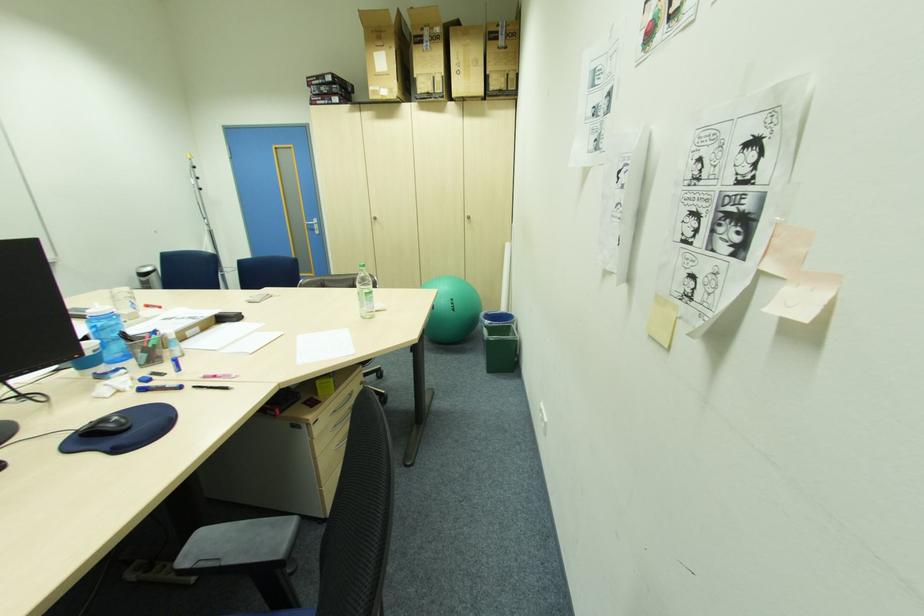
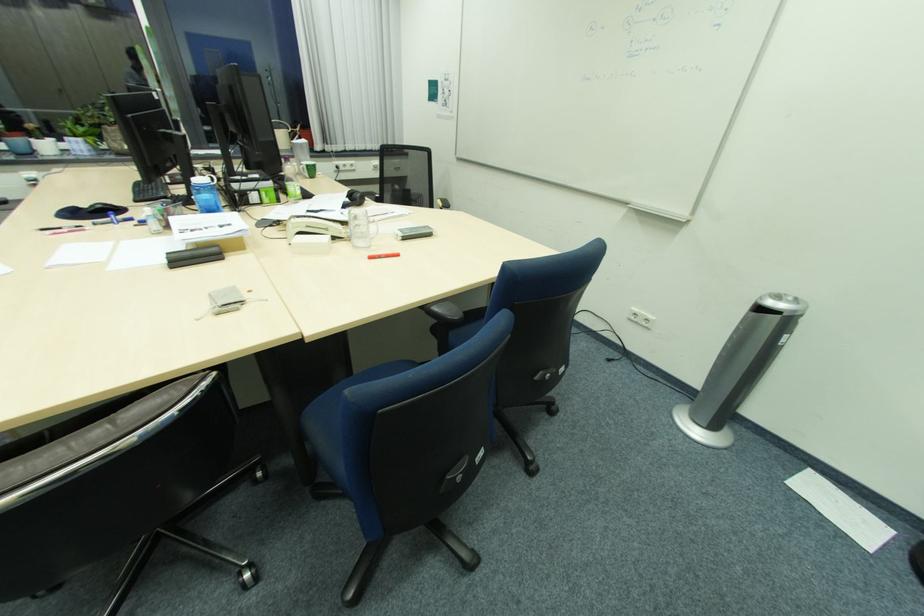
In the second image, find the point that corresponds to (165,309) in the first image.

(377, 257)